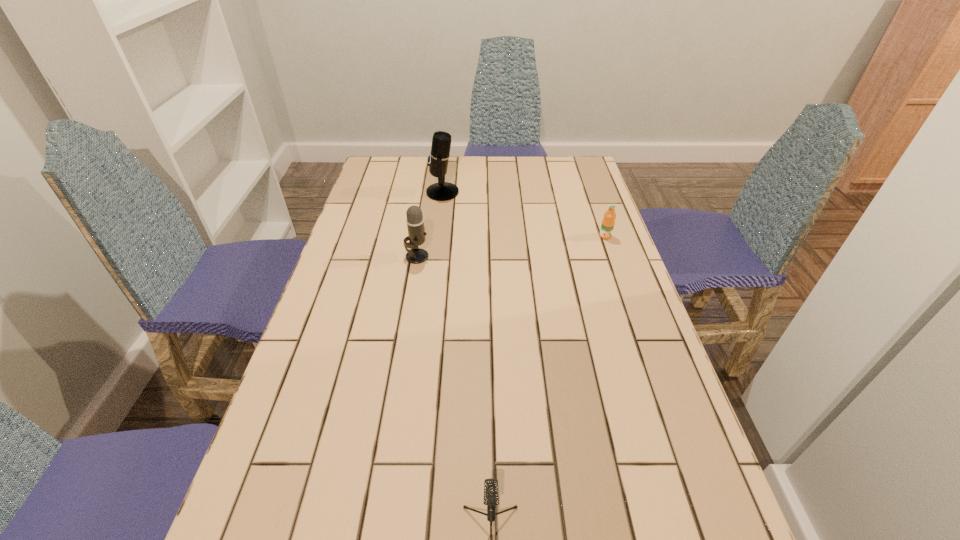
Where is `object at the right edge`? object at the right edge is located at coordinates (608, 221).

Locate an element on the screen. This screenshot has width=960, height=540. free spot at the far edge of the desktop is located at coordinates (463, 180).

The height and width of the screenshot is (540, 960). I want to click on vacant space at the left edge, so click(364, 292).

Identify the location of vacant space at the right edge of the desktop. (627, 360).

Locate an element on the screen. The image size is (960, 540). vacant area between the second farthest object and the second farthest microphone is located at coordinates (511, 246).

Image resolution: width=960 pixels, height=540 pixels. I want to click on vacant area that lies between the second shortest microphone and the rightmost object, so click(x=511, y=246).

You are a GUI agent. You are given a task and a screenshot of the screen. Output one action in this format:
    pyautogui.click(x=<x>, y=<y>)
    Task: Click on the free space between the farthest object and the second farthest object
    The width and height of the screenshot is (960, 540).
    Given the screenshot: What is the action you would take?
    pyautogui.click(x=524, y=214)

I want to click on object that is the third nearest to the third shortest object, so click(x=491, y=495).

Identify which object is the second closest to the rightmost microphone. Please provide its 2D coordinates. Your answer should be formatted as a tuple, i.e. [(x, y)], where the tuple contains the x and y coordinates of a point satisfying the conditions above.

[(608, 221)]

You are a GUI agent. You are given a task and a screenshot of the screen. Output one action in this format:
    pyautogui.click(x=<x>, y=<y>)
    Task: Click on the closest microphone to the second nearest microphone
    The height and width of the screenshot is (540, 960).
    Given the screenshot: What is the action you would take?
    pyautogui.click(x=439, y=156)